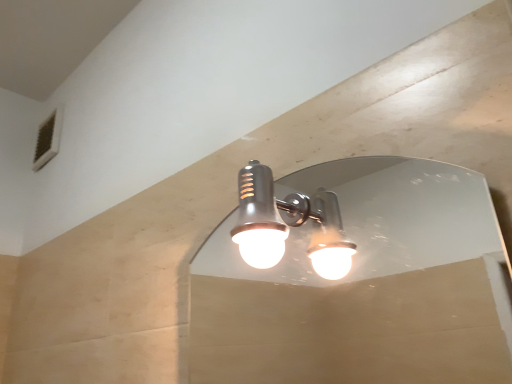
Question: Should I look upward or downward to see satin nickel light fixture at center?

Choices:
 (A) down
 (B) up

Answer: (A)